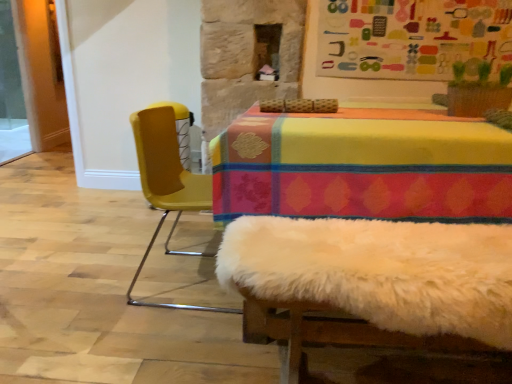
Question: Considering the relative sizes of yellow plastic chair at left and transparent glass screen door at left in the image provided, is yellow plastic chair at left wider than transparent glass screen door at left?

Choices:
 (A) yes
 (B) no

Answer: (A)

Question: From a real-world perspective, is yellow plastic chair at left physically below transparent glass screen door at left?

Choices:
 (A) yes
 (B) no

Answer: (A)

Question: From the image's perspective, is yellow plastic chair at left over transparent glass screen door at left?

Choices:
 (A) no
 (B) yes

Answer: (A)

Question: Is yellow plastic chair at left touching transparent glass screen door at left?

Choices:
 (A) yes
 (B) no

Answer: (B)

Question: Would you say yellow plastic chair at left is a long distance from transparent glass screen door at left?

Choices:
 (A) no
 (B) yes

Answer: (B)

Question: Is the position of yellow plastic chair at left more distant than that of transparent glass screen door at left?

Choices:
 (A) yes
 (B) no

Answer: (B)

Question: Does multicolored fabric bulletin board at upper center have a lesser width compared to yellow plastic chair at left?

Choices:
 (A) no
 (B) yes

Answer: (B)

Question: Is multicolored fabric bulletin board at upper center with yellow plastic chair at left?

Choices:
 (A) yes
 (B) no

Answer: (B)

Question: From a real-world perspective, is multicolored fabric bulletin board at upper center positioned over yellow plastic chair at left based on gravity?

Choices:
 (A) no
 (B) yes

Answer: (B)

Question: Is multicolored fabric bulletin board at upper center shorter than yellow plastic chair at left?

Choices:
 (A) yes
 (B) no

Answer: (A)

Question: Is multicolored fabric bulletin board at upper center located outside yellow plastic chair at left?

Choices:
 (A) yes
 (B) no

Answer: (A)

Question: Is there a large distance between multicolored fabric bulletin board at upper center and yellow plastic chair at left?

Choices:
 (A) no
 (B) yes

Answer: (B)

Question: Is multicolored fabric bulletin board at upper center to the left of transparent glass screen door at left from the viewer's perspective?

Choices:
 (A) no
 (B) yes

Answer: (A)